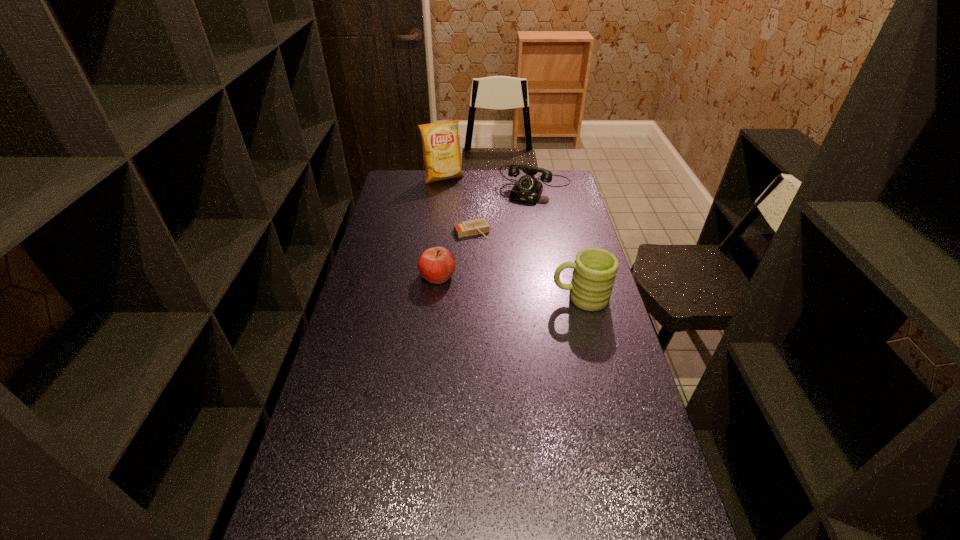
At what (x,y) coordinates should I click in order to perform the action: click on vacant space that is in between the matchbox and the telephone. Please return your answer as a coordinate pair (x, y). Image resolution: width=960 pixels, height=540 pixels. Looking at the image, I should click on (504, 210).

The width and height of the screenshot is (960, 540). I want to click on free area in between the tallest object and the telephone, so click(x=490, y=184).

This screenshot has height=540, width=960. In order to click on empty space that is in between the tallest object and the apple in this screenshot , I will do `click(441, 227)`.

Where is `free area in between the mug and the apple`? Image resolution: width=960 pixels, height=540 pixels. free area in between the mug and the apple is located at coordinates (509, 287).

The height and width of the screenshot is (540, 960). In order to click on unoccupied position between the shortest object and the apple in this screenshot , I will do `click(455, 253)`.

Where is `free space between the tallest object and the apple`? free space between the tallest object and the apple is located at coordinates tap(441, 227).

Where is `free spot between the apple and the mug`? This screenshot has height=540, width=960. free spot between the apple and the mug is located at coordinates click(x=509, y=287).

I want to click on vacant space that is in between the apple and the telephone, so click(487, 232).

You are a GUI agent. You are given a task and a screenshot of the screen. Output one action in this format:
    pyautogui.click(x=<x>, y=<y>)
    Task: Click on the vacant point located between the matchbox and the mug
    The height and width of the screenshot is (540, 960).
    Given the screenshot: What is the action you would take?
    pyautogui.click(x=526, y=265)

In order to click on object that stands as the third closest to the apple in this screenshot , I will do `click(527, 189)`.